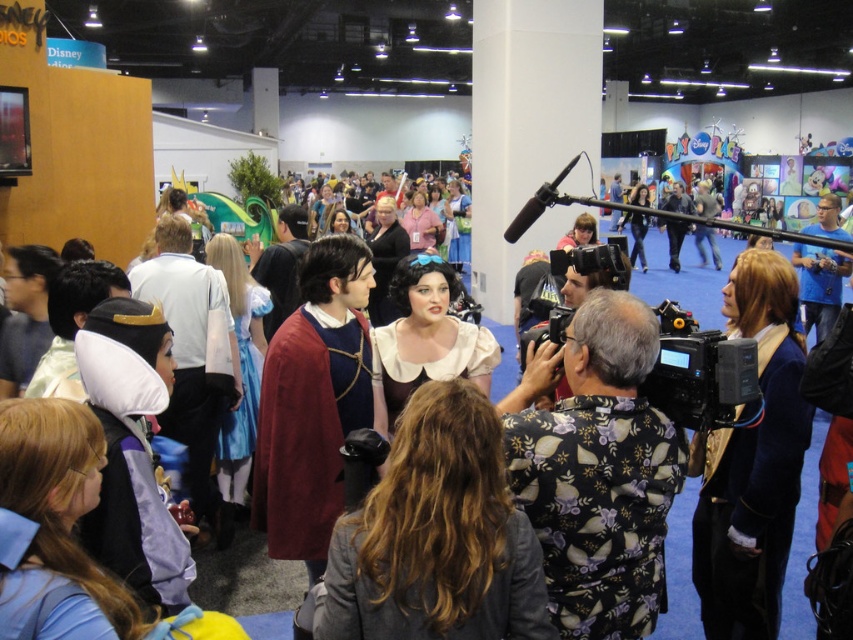
Question: Can you confirm if dark brown hair at center is bigger than blue velvet jacket at right?

Choices:
 (A) no
 (B) yes

Answer: (A)

Question: Can you confirm if blue velvet jacket at right is positioned to the left of smooth white wig at center?

Choices:
 (A) yes
 (B) no

Answer: (A)

Question: Which object is positioned closest to the smooth white wig at center?

Choices:
 (A) floral-patterned shirt at center-right
 (B) blue velvet jacket at right
 (C) dark brown hair at center

Answer: (A)

Question: Is dark brown hair at center below smooth white wig at center?

Choices:
 (A) yes
 (B) no

Answer: (A)

Question: Which object appears closest to the camera in this image?

Choices:
 (A) blue velvet jacket at right
 (B) floral-patterned shirt at center-right

Answer: (B)

Question: Estimate the real-world distances between objects in this image. Which object is closer to the blue velvet jacket at right?

Choices:
 (A) floral-patterned shirt at center-right
 (B) smooth white wig at center
 (C) dark brown hair at center

Answer: (A)